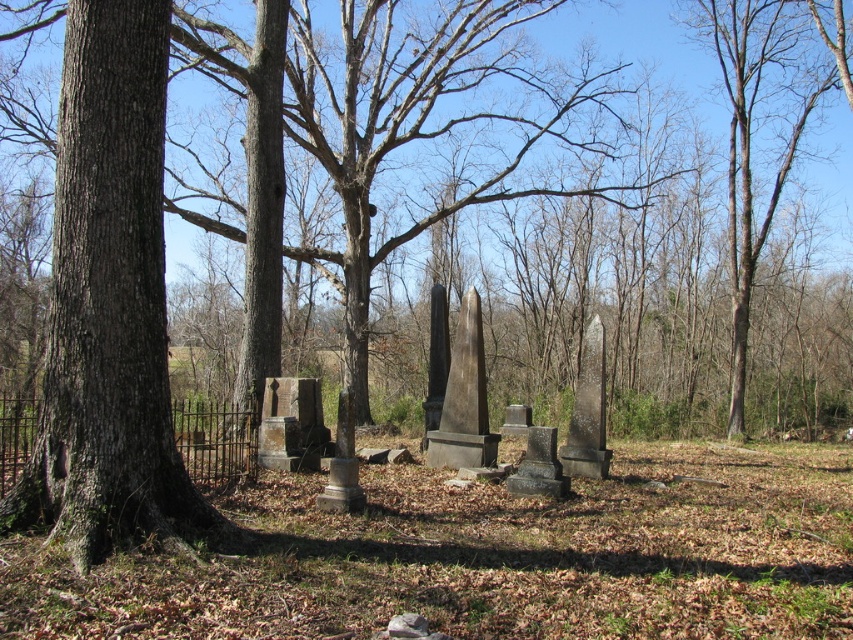
You are a gardener planning to plant a new tree exactly halfway between the brown rough bark tree at left and the brown bark tree at right. What is the minimum distance you need to walk from either tree to reach the planting spot?

The distance between the brown rough bark tree at left and the brown bark tree at right is 20.98 meters. Half of this distance is approximately 10.49 meters, so the gardener needs to walk at least 10.49 meters from either tree to reach the planting spot.

You are standing in the cemetery and want to take a photo of both the brown rough bark tree at left and the brown bark tree at right. Which tree should you stand closer to in order to fit both into the frame without zooming?

You should stand closer to the brown rough bark tree at left since it is shorter than the brown bark tree at right, allowing both to be captured in the frame when positioned nearer to the smaller tree.